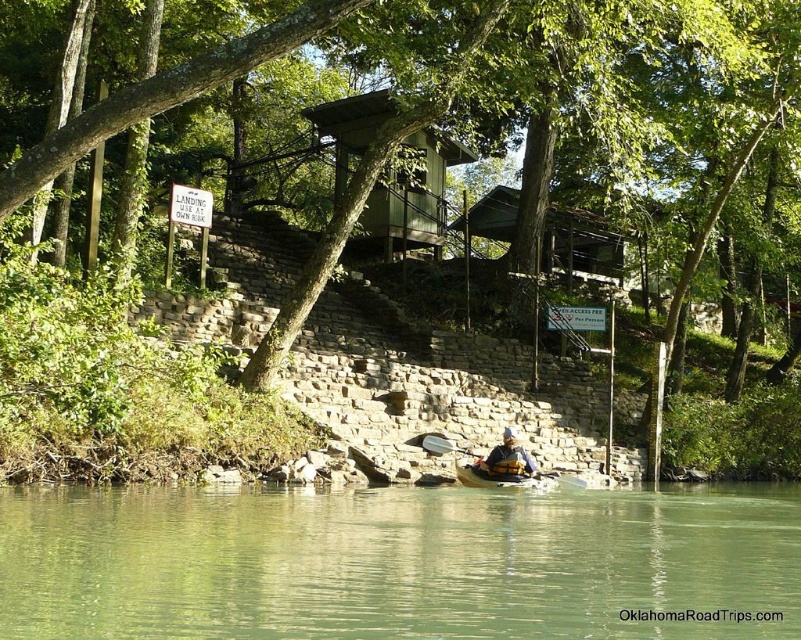
You are standing on the riverside and see the wooden paddle at center and the yellow plastic canoe at center. Which object is closer to your right side?

The wooden paddle at center is to the right of yellow plastic canoe at center, so the wooden paddle at center is closer to your right side.

Consider the image. You are a photographer planning to capture the reflection of the wooden paddle at center in the green translucent water at lower center. Based on the scene, can the paddle be fully reflected in the water?

The green translucent water at lower center is shorter than the wooden paddle at center. Since the water is not deep enough to fully reflect the paddle, the reflection will be incomplete.

In the scene shown: What is the color and transparency of the water at the point specified by the coordinates (x=400, y=563) in the image?

The water at point (x=400, y=563) is green and translucent.